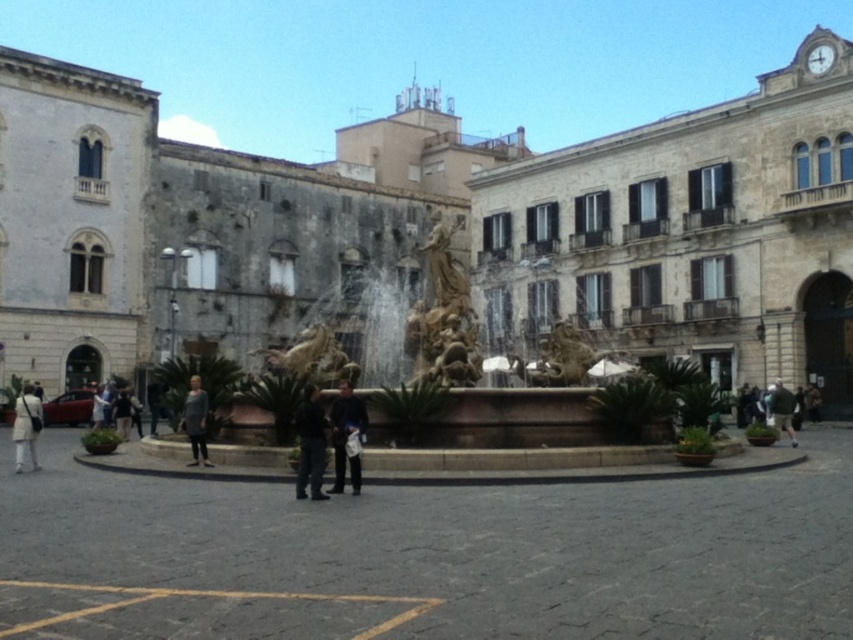
Question: Is dark blue fabric pants at center thinner than light beige coat at lower left?

Choices:
 (A) yes
 (B) no

Answer: (A)

Question: Which point appears farthest from the camera in this image?

Choices:
 (A) (19, 403)
 (B) (430, 376)
 (C) (775, 412)
 (D) (341, 408)

Answer: (C)

Question: In this image, where is white stone building at left located relative to green fabric jacket at lower right?

Choices:
 (A) below
 (B) above

Answer: (B)

Question: Does dark gray fabric pants at center have a greater width compared to light beige coat at lower left?

Choices:
 (A) yes
 (B) no

Answer: (B)

Question: Which object is the farthest from the dark gray fabric pants at center?

Choices:
 (A) white stone building at upper right
 (B) golden stone fountain at center
 (C) smooth stone fountain at center

Answer: (A)

Question: Which object appears closest to the camera in this image?

Choices:
 (A) light beige coat at lower left
 (B) white stone building at left
 (C) gray fabric jacket at center

Answer: (A)